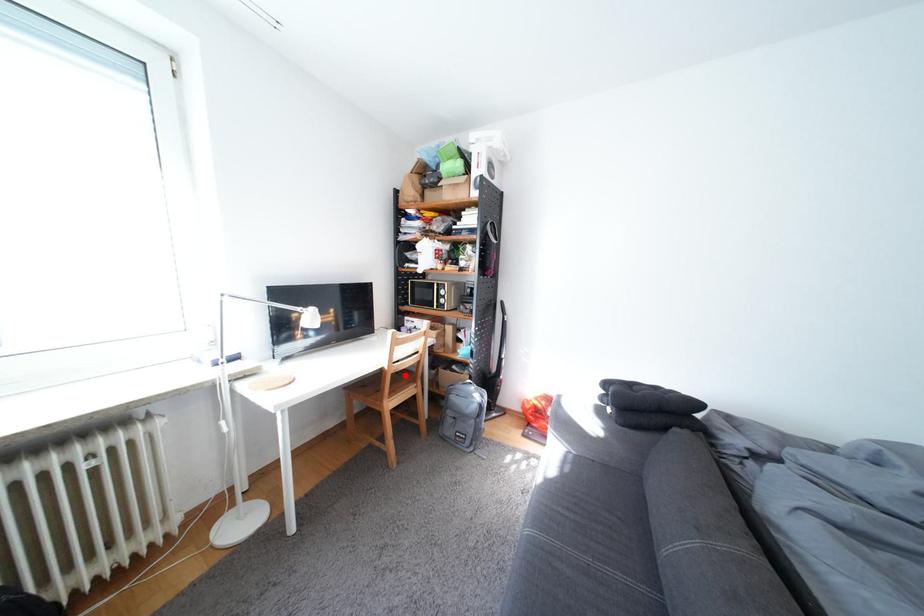
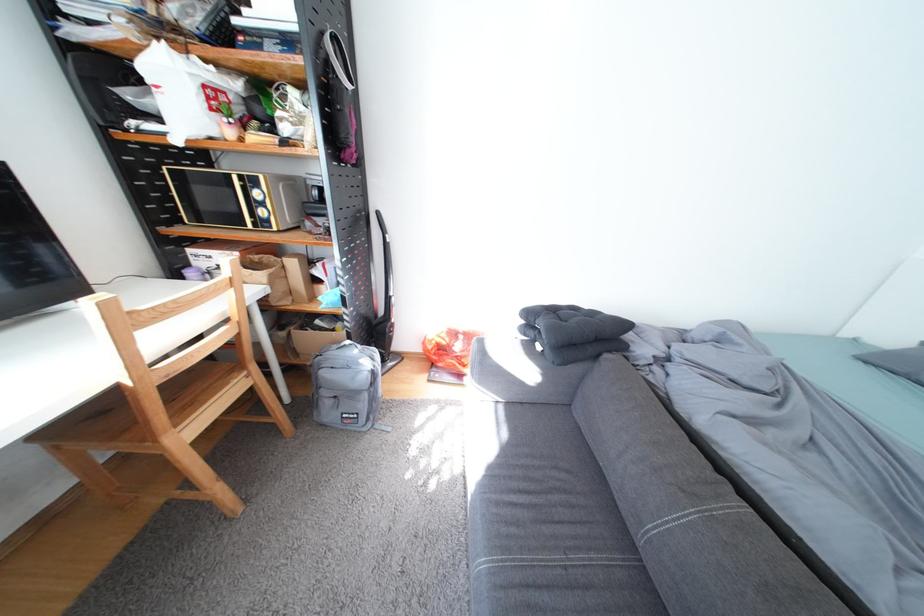
The point at the highlighted location is marked in the first image. Where is the corresponding point in the second image?

(176, 387)